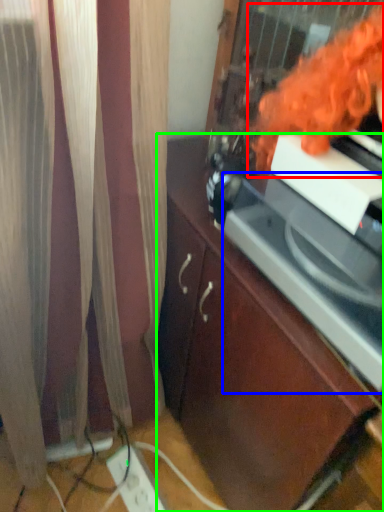
Question: Which is farther away from woman (highlighted by a red box)? appliance (highlighted by a blue box) or cabinetry (highlighted by a green box)?

Choices:
 (A) appliance
 (B) cabinetry

Answer: (B)